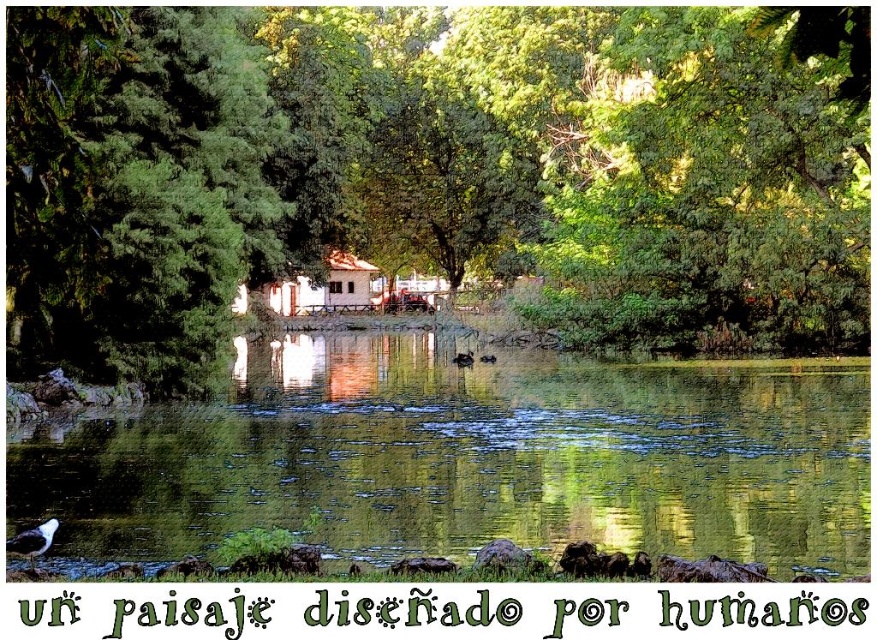
You are standing at the edge of the pond and notice two points in the scene. The first point is at coordinate point [65,428] and the second is at point [305,285]. Which point is closer to your current position?

Point [65,428] is closer to the camera than point [305,285], so the first point is closer to your current position.

You are standing at the edge of the pond and see the green leafy tree at center and the green reflective water at center. Which object is taller?

The green leafy tree at center is much taller than the green reflective water at center.